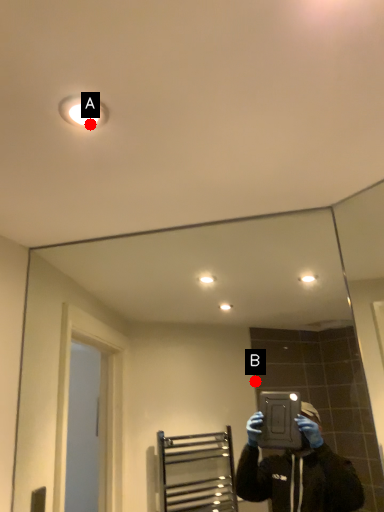
Question: Two points are circled on the image, labeled by A and B beside each circle. Which point is closer to the camera taking this photo?

Choices:
 (A) A is closer
 (B) B is closer

Answer: (A)